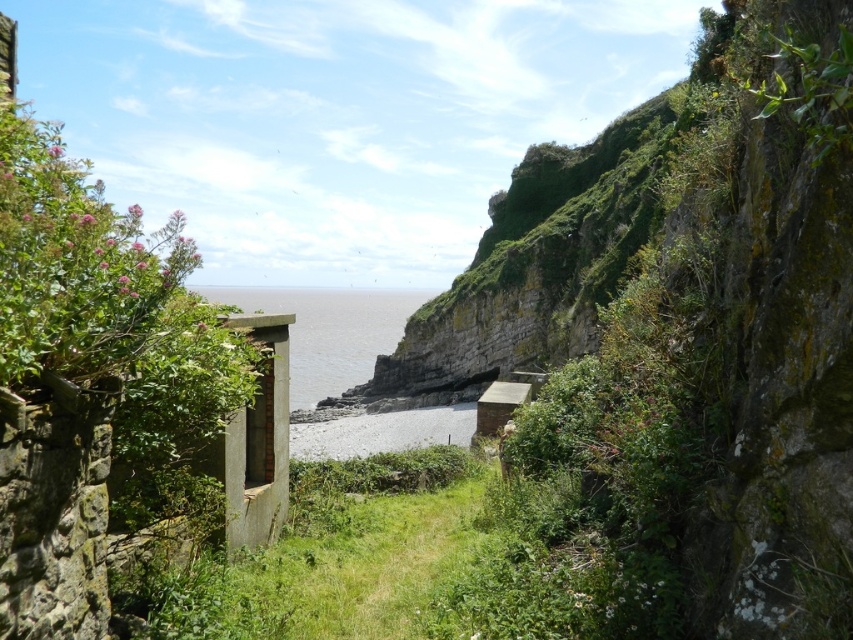
Question: Which object is farther from the camera taking this photo?

Choices:
 (A) clear blue water at center
 (B) gray gravel at center

Answer: (B)

Question: Is the position of clear blue water at center less distant than that of gray gravel at center?

Choices:
 (A) yes
 (B) no

Answer: (A)

Question: Observing the image, what is the correct spatial positioning of clear blue water at center in reference to gray gravel at center?

Choices:
 (A) right
 (B) left

Answer: (B)

Question: Can you confirm if clear blue water at center is smaller than gray gravel at center?

Choices:
 (A) no
 (B) yes

Answer: (A)

Question: Which point is closer to the camera?

Choices:
 (A) clear blue water at center
 (B) gray gravel at center

Answer: (A)